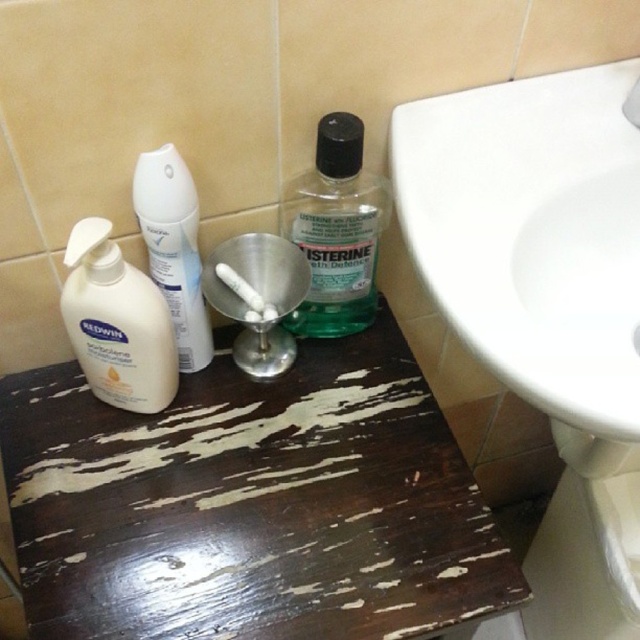
Question: Which object is farther from the camera taking this photo?

Choices:
 (A) dark wood table at center
 (B) white matte spray can at center

Answer: (A)

Question: Which point is closer to the camera taking this photo?

Choices:
 (A) (163, 241)
 (B) (369, 241)
 (C) (545, 228)

Answer: (A)

Question: Is dark wood table at center closer to the viewer compared to green translucent plastic mouthwash at center?

Choices:
 (A) yes
 (B) no

Answer: (A)

Question: Is green translucent plastic mouthwash at center closer to the viewer compared to white matte lotion at left?

Choices:
 (A) yes
 (B) no

Answer: (B)

Question: Can you confirm if dark wood table at center is wider than white matte lotion at left?

Choices:
 (A) no
 (B) yes

Answer: (B)

Question: Which point is farther to the camera?

Choices:
 (A) (84, 221)
 (B) (195, 211)
 (C) (362, 150)

Answer: (C)